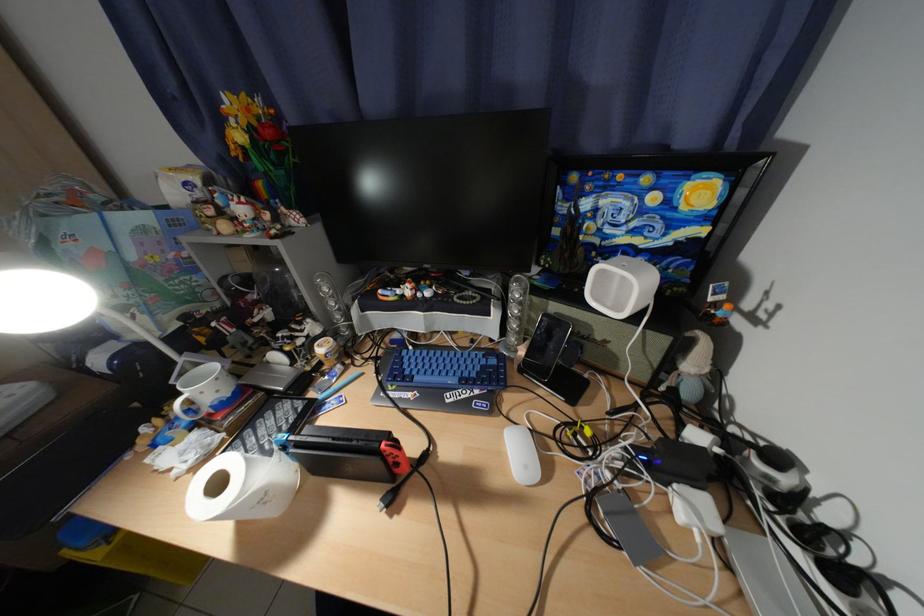
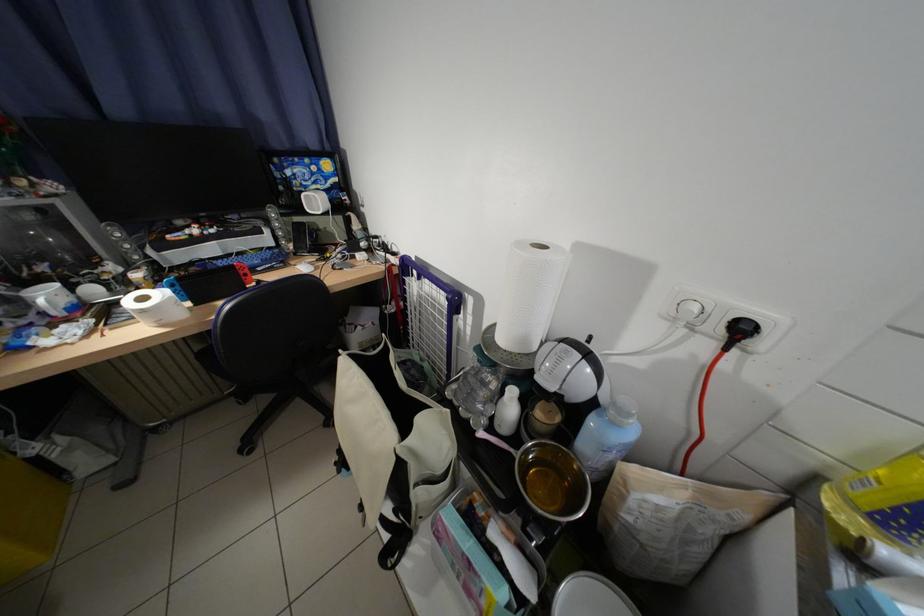
In the second image, find the point that corresponds to (x=229, y=485) in the first image.

(155, 301)